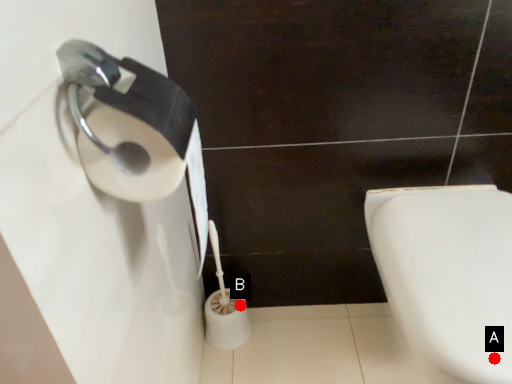
Question: Two points are circled on the image, labeled by A and B beside each circle. Among these points, which one is nearest to the camera?

Choices:
 (A) A is closer
 (B) B is closer

Answer: (A)